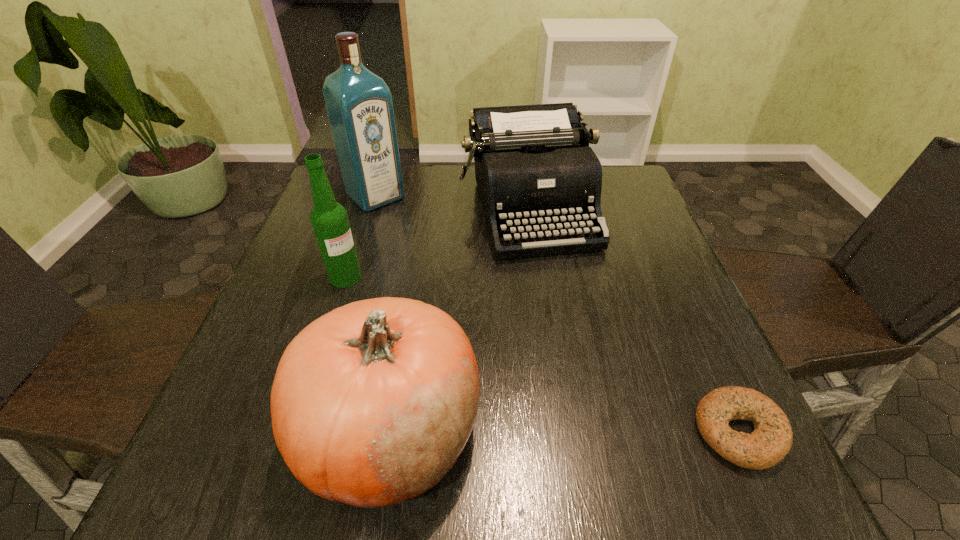
Find the location of `free space at the far edge of the desktop`. free space at the far edge of the desktop is located at coordinates (427, 187).

In the image, there is a desktop. Where is `vacant space at the near edge`? Image resolution: width=960 pixels, height=540 pixels. vacant space at the near edge is located at coordinates (569, 389).

Where is `free space at the left edge of the desktop`? free space at the left edge of the desktop is located at coordinates (261, 321).

The height and width of the screenshot is (540, 960). In the image, there is a desktop. Find the location of `free space at the far right corner`. free space at the far right corner is located at coordinates (611, 210).

I want to click on free point between the rightmost object and the third nearest object, so pyautogui.click(x=542, y=354).

The image size is (960, 540). Identify the location of unoccupied area between the typewriter and the shortest object. pos(634,320).

This screenshot has width=960, height=540. I want to click on unoccupied position between the pumpkin and the bagel, so click(564, 431).

At what (x,y) coordinates should I click in order to perform the action: click on vacant space in between the pumpkin and the fourth tallest object. Please return your answer as a coordinate pair (x, y). The width and height of the screenshot is (960, 540). Looking at the image, I should click on (460, 320).

You are a GUI agent. You are given a task and a screenshot of the screen. Output one action in this format:
    pyautogui.click(x=<x>, y=<y>)
    Task: Click on the free area in between the beer bottle and the second shortest object
    This screenshot has height=540, width=960.
    Given the screenshot: What is the action you would take?
    438,243

In order to click on free space that is in between the rightmost object and the tallest object in this screenshot , I will do `click(557, 314)`.